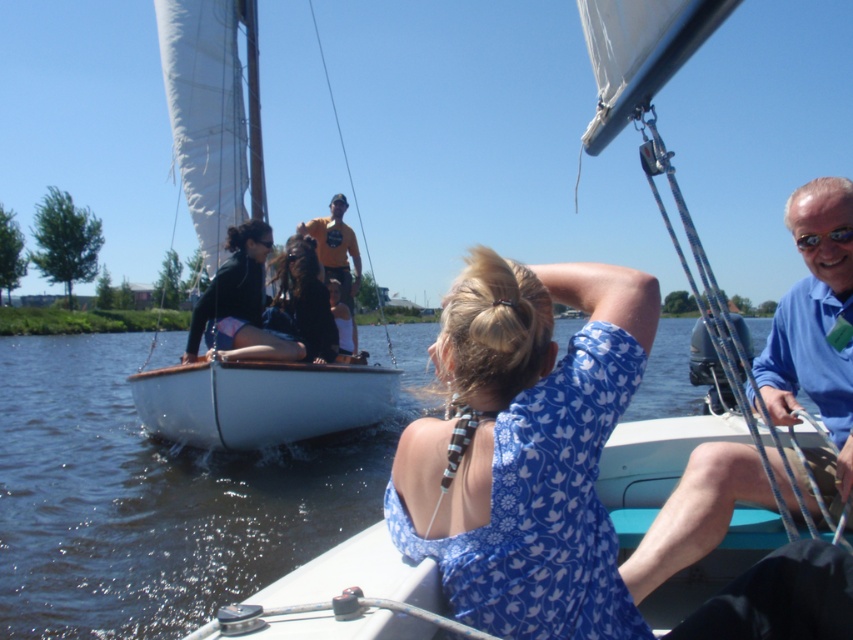
Question: Does matte black wetsuit at center have a larger size compared to clear plastic goggles at upper right?

Choices:
 (A) no
 (B) yes

Answer: (B)

Question: Considering the relative positions of blue floral dress at center and orange t-shirt at upper center in the image provided, where is blue floral dress at center located with respect to orange t-shirt at upper center?

Choices:
 (A) right
 (B) left

Answer: (A)

Question: Which object is closer to the camera taking this photo?

Choices:
 (A) blue floral dress at center
 (B) white matte sailboat at center
 (C) orange t-shirt at upper center
 (D) blue cotton shirt at right

Answer: (A)

Question: Which object appears closest to the camera in this image?

Choices:
 (A) orange t-shirt at upper center
 (B) clear water at center
 (C) blue cotton shirt at right
 (D) white matte sailboat at center

Answer: (B)

Question: Which of the following is the farthest from the observer?

Choices:
 (A) matte black wetsuit at center
 (B) clear water at center
 (C) white matte sailboat at center
 (D) blue floral dress at center

Answer: (C)

Question: In this image, where is clear water at center located relative to clear plastic goggles at upper right?

Choices:
 (A) left
 (B) right

Answer: (A)